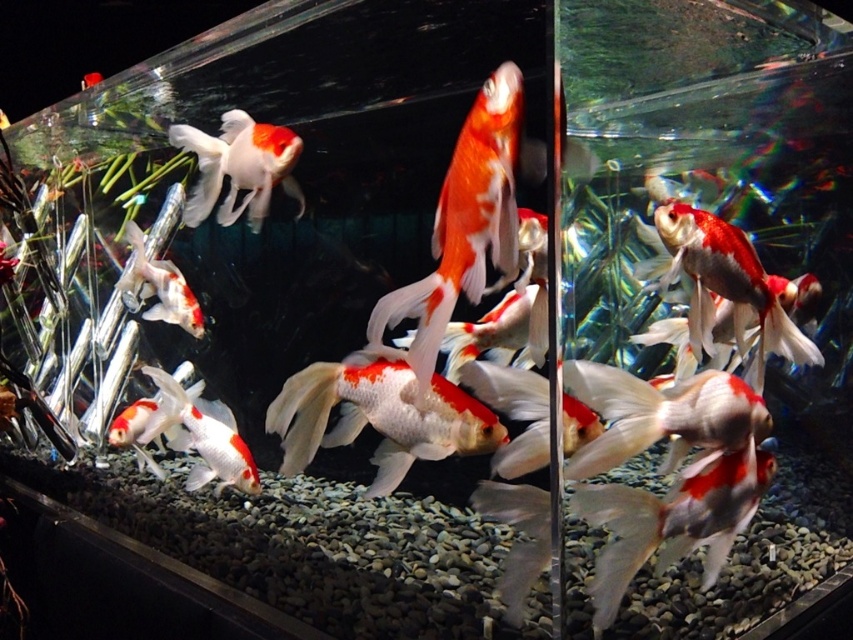
Question: Can you confirm if shiny metallic goldfish at center is thinner than shiny orange and white goldfish at upper left?

Choices:
 (A) yes
 (B) no

Answer: (A)

Question: Among these points, which one is farthest from the camera?

Choices:
 (A) (514, 76)
 (B) (236, 216)
 (C) (704, 237)

Answer: (B)

Question: Is shiny orange and white fish at center bigger than shiny orange and white goldfish at upper left?

Choices:
 (A) no
 (B) yes

Answer: (A)

Question: Among these objects, which one is nearest to the camera?

Choices:
 (A) shiny orange and white fish at center
 (B) shiny metallic goldfish at center
 (C) shiny orange and white goldfish at upper left

Answer: (A)

Question: Which point appears closest to the camera in this image?

Choices:
 (A) coord(236,156)
 (B) coord(421,280)
 (C) coord(738,292)

Answer: (B)

Question: Where is shiny orange and white fish at center located in relation to shiny orange and white goldfish at upper left in the image?

Choices:
 (A) right
 (B) left

Answer: (A)